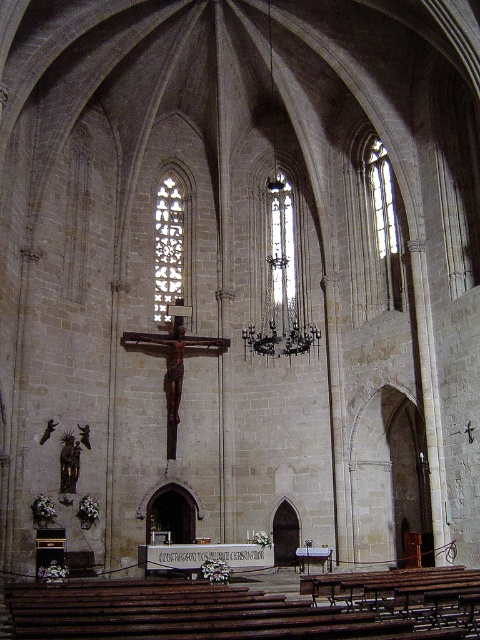
You are standing inside the grand Gothic church and notice two points marked on the wall. The first point is at coordinates point [288,218] and the second is at point [274,180]. Which point is closer to you?

Point [288,218] is closer to the viewer than point [274,180].

You are an interior designer planning to install a new lighting fixture in the church. You have a choice between a narrow fixture that must fit under the clear glass window at upper right and a wider one that needs to align with the dark bronze chandelier at center. Based on their sizes, which fixture should you choose for each location?

The dark bronze chandelier at center might be wider than clear glass window at upper right, so the wider lighting fixture should align with the dark bronze chandelier at center, and the narrow one should fit under the clear glass window at upper right.

You are an architect designing a new church and want to ensure the stained glass windows are proportionally balanced. Given the clear glass stained glass window at center and the clear glass window at upper right, which one should be placed higher to maintain visual harmony?

The clear glass stained glass window at center should be placed higher because it is much taller than the clear glass window at upper right, ensuring visual harmony by aligning their proportions with their positions.